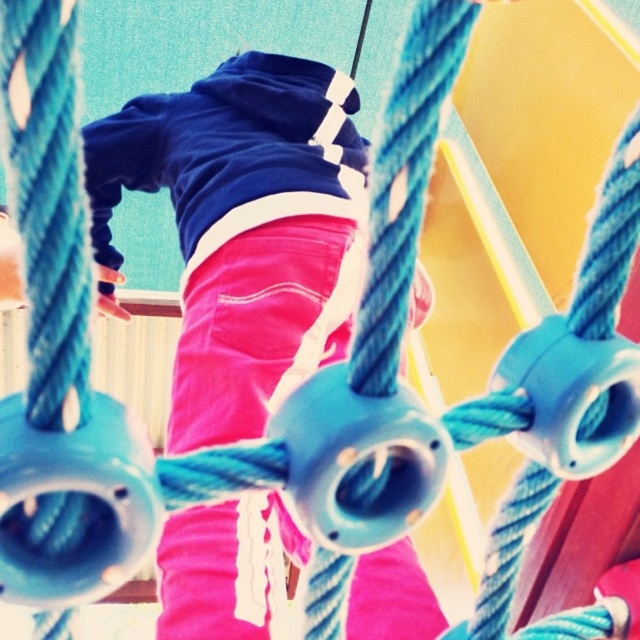
From the picture: You are a fashion designer observing a child playing in a playground. The child is wearing the pink corduroy pants at center and the velvet blue sweatshirt at upper center. Which clothing item takes up more space visually in the image?

The pink corduroy pants at center takes up more space visually in the image since it has a larger size compared to the velvet blue sweatshirt at upper center.

The child is wearing two items of clothing. Which one is closer to the ground, the pink corduroy pants at center or the velvet blue sweatshirt at upper center?

The pink corduroy pants at center is closer to the ground because it is 1.71 inches from the velvet blue sweatshirt at upper center, which is located at upper center and thus higher up.

Based on the scene description, which object is wider when comparing the pink corduroy pants at center and the velvet blue sweatshirt at upper center?

The pink corduroy pants at center are wider than the velvet blue sweatshirt at upper center according to the description.